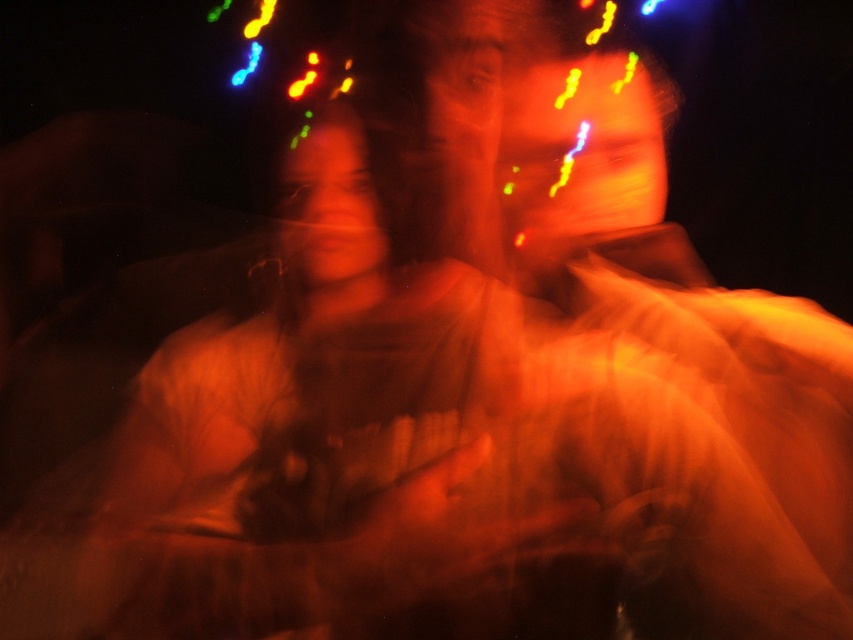
Is matte orange shirt at center taller than matte orange face at center?

Yes.

Which is in front, point (135, 525) or point (318, 260)?

Point (135, 525) is more forward.

This screenshot has width=853, height=640. I want to click on matte orange shirt at center, so click(315, 436).

This screenshot has height=640, width=853. I want to click on matte orange shirt at center, so click(x=315, y=436).

Which is more to the right, orange matte face at upper center or matte orange face at center?

Positioned to the right is orange matte face at upper center.

Where is `orange matte face at upper center`? This screenshot has width=853, height=640. orange matte face at upper center is located at coordinates (592, 148).

The height and width of the screenshot is (640, 853). I want to click on orange matte face at upper center, so click(x=592, y=148).

This screenshot has height=640, width=853. What do you see at coordinates (315, 436) in the screenshot?
I see `matte orange shirt at center` at bounding box center [315, 436].

Who is more distant from viewer, (302, 492) or (553, 136)?

The point (553, 136) is behind.

This screenshot has width=853, height=640. In order to click on matte orange shirt at center in this screenshot , I will do `click(315, 436)`.